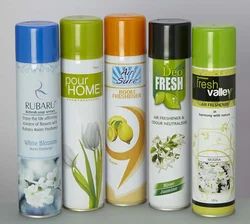
Locate an element on the screen. The height and width of the screenshot is (224, 250). canister is located at coordinates (51, 126), (87, 129), (144, 122), (178, 132), (212, 140).